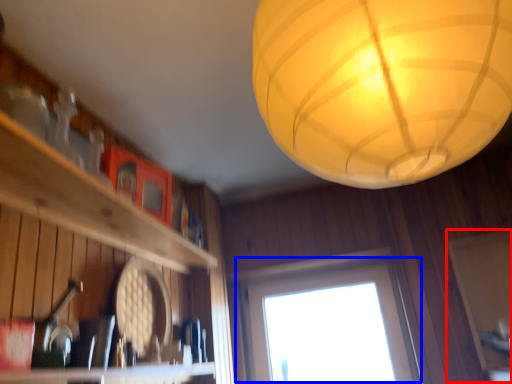
Question: Which object is closer to the camera taking this photo, screen door (highlighted by a red box) or window (highlighted by a blue box)?

Choices:
 (A) screen door
 (B) window

Answer: (A)